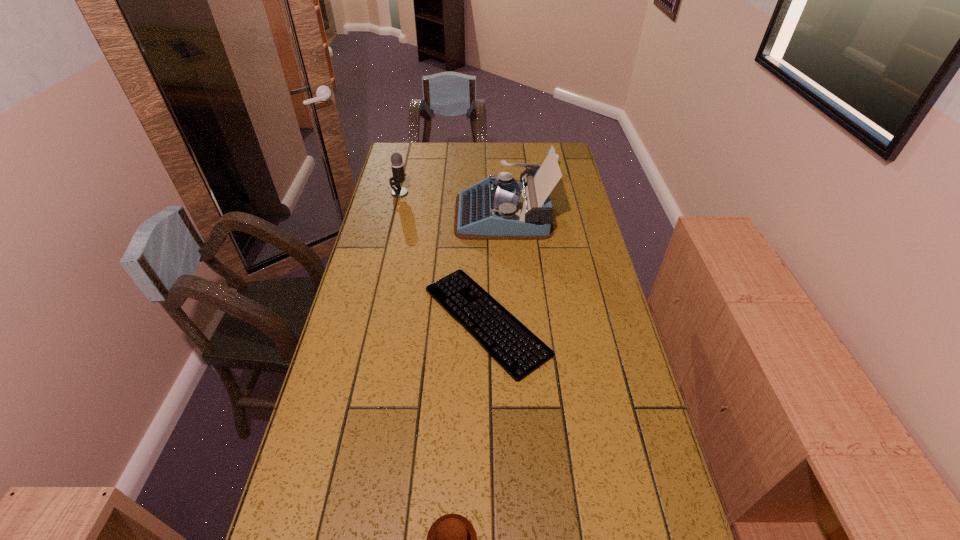
In the image, there is a desktop. At what (x,y) coordinates should I click in order to perform the action: click on vacant region at the right edge. Please return your answer as a coordinate pair (x, y). The width and height of the screenshot is (960, 540). Looking at the image, I should click on (602, 262).

At what (x,y) coordinates should I click in order to perform the action: click on vacant region between the fourth farthest object and the fourth shortest object. Please return your answer as a coordinate pair (x, y). The height and width of the screenshot is (540, 960). Looking at the image, I should click on (443, 256).

This screenshot has width=960, height=540. Identify the location of vacant area between the tallest object and the microphone. pos(451,203).

Where is `unoccupied area between the tallest object and the shortest object`? This screenshot has height=540, width=960. unoccupied area between the tallest object and the shortest object is located at coordinates (494, 267).

Identify the location of unoccupied position between the leftmost object and the computer keyboard. (x=443, y=256).

The width and height of the screenshot is (960, 540). What are the coordinates of `empty space between the computer keyboard and the leftmost object` in the screenshot? It's located at (443, 256).

Select which object is the second closest to the shorter muffin. Please provide its 2D coordinates. Your answer should be formatted as a tuple, i.e. [(x, y)], where the tuple contains the x and y coordinates of a point satisfying the conditions above.

[(501, 208)]

Point out which object is positioned as the fourth nearest to the typewriter. Please provide its 2D coordinates. Your answer should be formatted as a tuple, i.e. [(x, y)], where the tuple contains the x and y coordinates of a point satisfying the conditions above.

[(451, 539)]

Locate an element on the screen. Image resolution: width=960 pixels, height=540 pixels. vacant space that satisfies the following two spatial constraints: 1. on the front side of the second tallest object; 2. on the left side of the fourth farthest object is located at coordinates (370, 320).

Locate an element on the screen. vacant region that satisfies the following two spatial constraints: 1. on the front-facing side of the rightmost object; 2. on the typing side of the tallest object is located at coordinates coord(562,214).